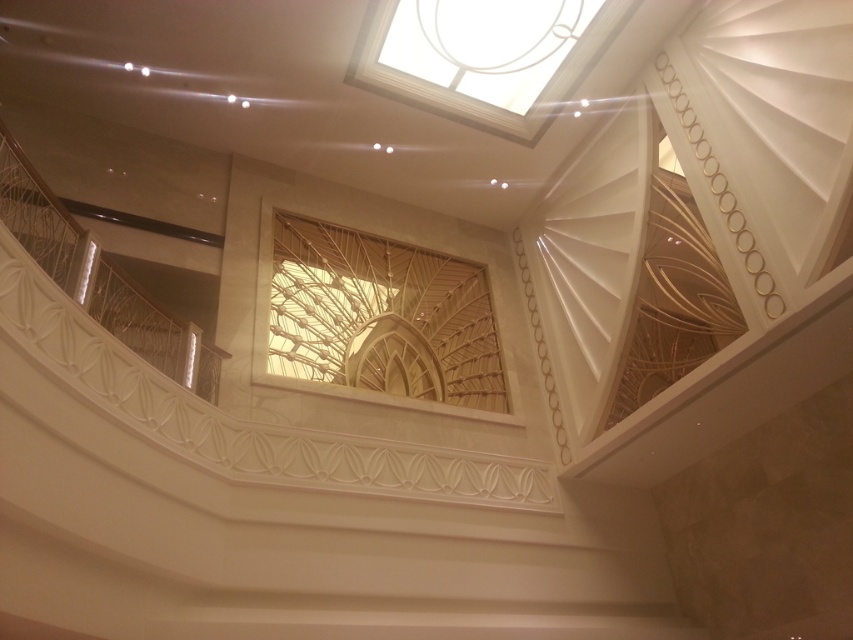
Question: Can you confirm if translucent wood lattice at center is wider than transparent glass skylight at upper center?

Choices:
 (A) yes
 (B) no

Answer: (B)

Question: Which object is farther from the camera taking this photo?

Choices:
 (A) translucent wood lattice at center
 (B) transparent glass skylight at upper center

Answer: (A)

Question: Which point appears farthest from the camera in this image?

Choices:
 (A) (369, 260)
 (B) (390, 52)

Answer: (A)

Question: Can you confirm if translucent wood lattice at center is bigger than transparent glass skylight at upper center?

Choices:
 (A) no
 (B) yes

Answer: (B)

Question: Is translucent wood lattice at center to the right of transparent glass skylight at upper center from the viewer's perspective?

Choices:
 (A) no
 (B) yes

Answer: (A)